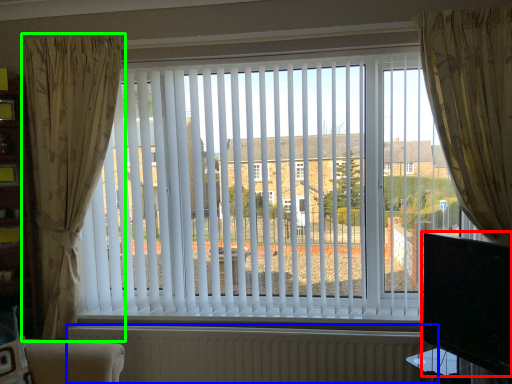
Question: Which object is the closest to the window screen (highlighted by a red box)? Choose among these: radiator (highlighted by a blue box) or curtain (highlighted by a green box).

Choices:
 (A) radiator
 (B) curtain

Answer: (A)